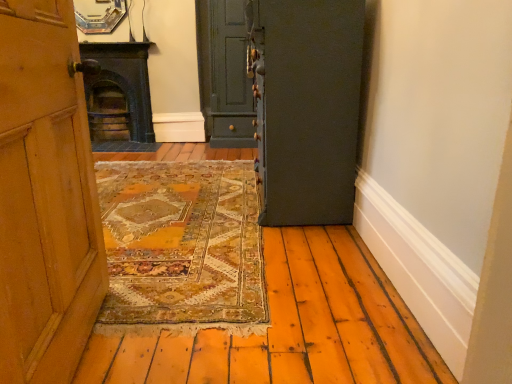
Question: Would you say matte green door at center, placed as the second door when sorted from right to left, is to the left or to the right of dark gray matte door at center, which appears as the 1th door when viewed from the right, in the picture?

Choices:
 (A) left
 (B) right

Answer: (A)

Question: From the image's perspective, is matte green door at center, marked as the second door in a front-to-back arrangement, positioned above or below dark gray matte door at center, the 1th door from the front?

Choices:
 (A) above
 (B) below

Answer: (A)

Question: Which is farther from the dark green stone fireplace at left?

Choices:
 (A) matte green door at center, placed as the first door when sorted from back to front
 (B) dark gray matte door at center, which ranks as the 2th door in left-to-right order

Answer: (B)

Question: Which object is the closest to the dark green stone fireplace at left?

Choices:
 (A) matte green door at center, placed as the second door when sorted from right to left
 (B) dark gray matte door at center, the 2th door viewed from the back

Answer: (A)